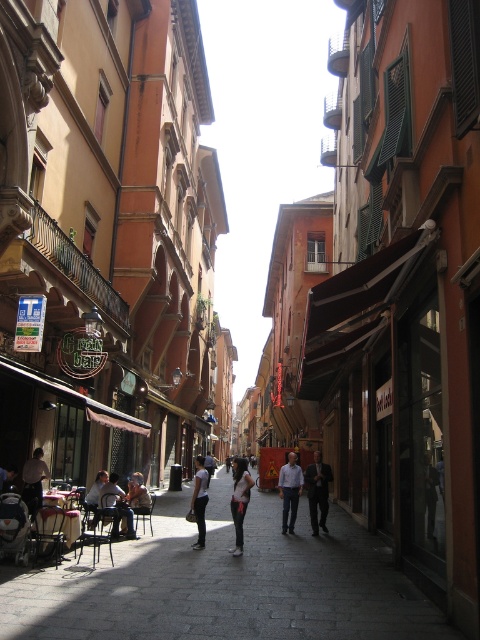
You are standing at the entrance of Gran Bar and want to sit at the light brown wooden chair at center. Based on the coordinates provided, in which direction should you walk to reach the chair?

The light brown wooden chair at center is located at coordinates point [116,506]. Since the y coordinate is 0.242, which is closer to the bottom of the image, you should walk forward towards the bottom of the image to reach the chair.

You are standing at the Gran Bar cafe and want to walk to the point marked as point [282,474]. However, there is an obstacle at point [197,497]. Will you be able to reach your destination without going around the obstacle?

Since point [282,474] is behind point [197,497], you would need to go around the obstacle at point [197,497] to reach your destination.

You are standing on the street and want to walk from point A to point B. Point A is at coordinate (118, 536) and point B is at coordinate (96, 490). Which point should you start from to be closer to the Gran Bar cafe?

You should start from point A at coordinate (118, 536) because it is closer to the Gran Bar cafe than point B at coordinate (96, 490). Since point A is further to the viewer, it is nearer in the scene compared to point B which is farther away.